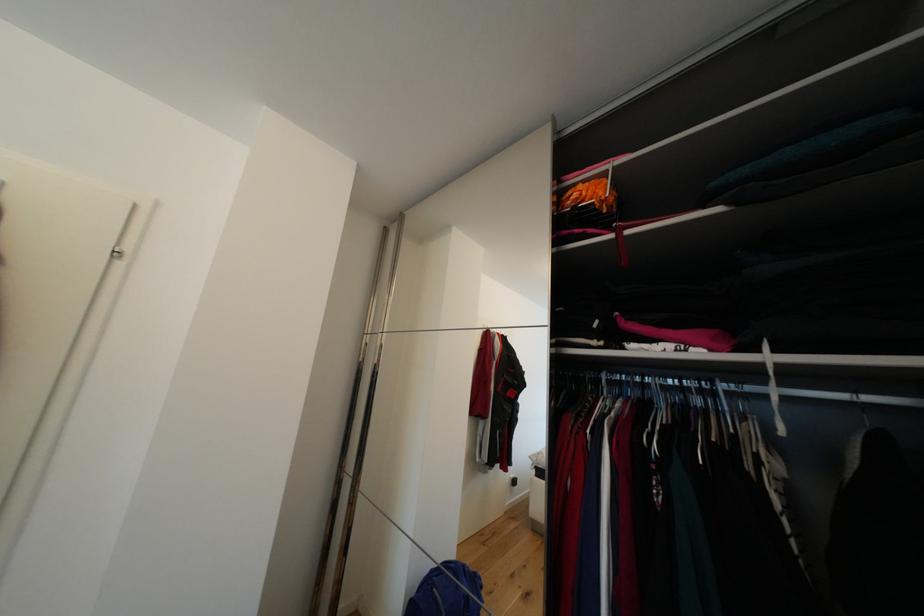
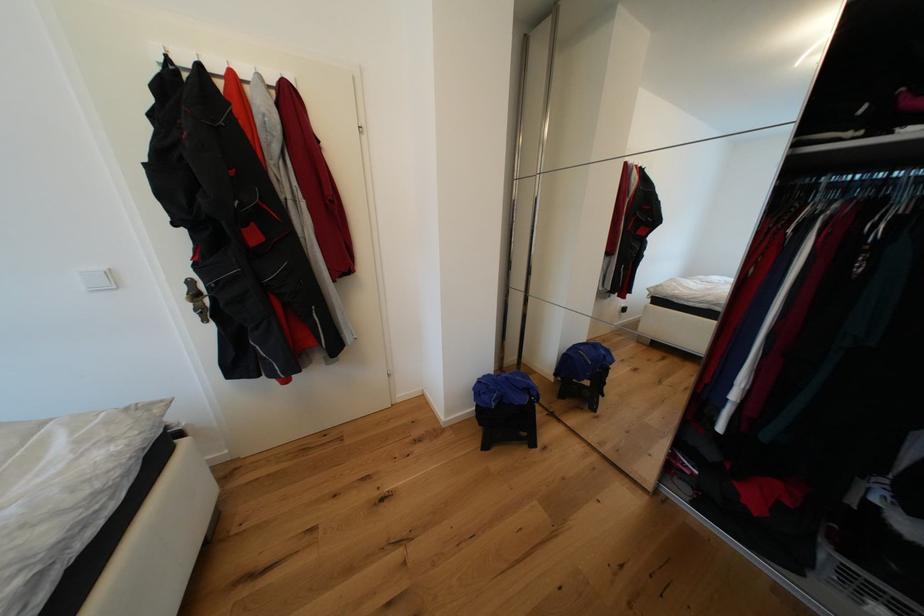
The images are taken continuously from a first-person perspective. In which direction is your viewpoint rotating?

The camera rotated toward left-down.